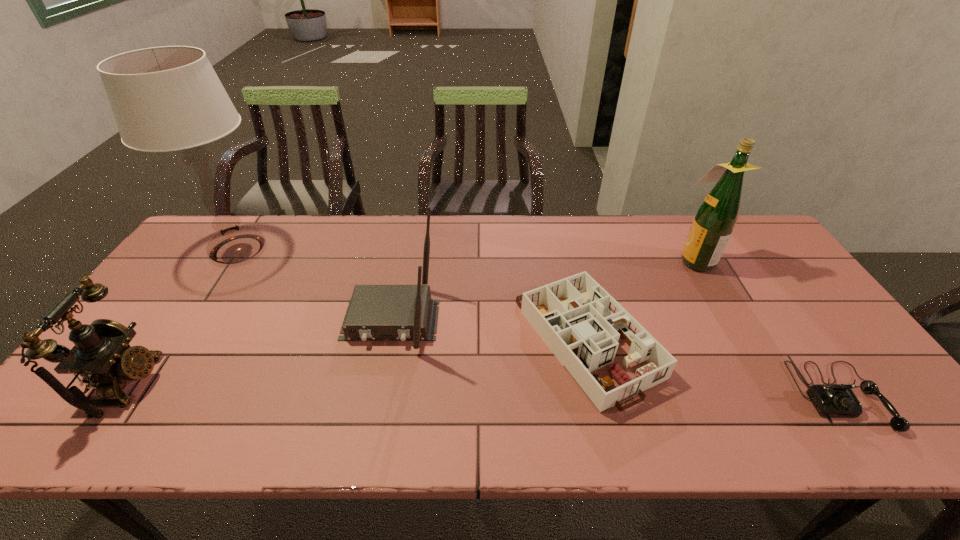
The height and width of the screenshot is (540, 960). What are the coordinates of `object located at the right edge` in the screenshot? It's located at (831, 400).

Where is `object that is positioned at the far left corner`? object that is positioned at the far left corner is located at coordinates (169, 98).

Locate an element on the screen. This screenshot has height=540, width=960. object that is at the near left corner is located at coordinates (101, 354).

At what (x,y) coordinates should I click in order to perform the action: click on object at the near right corner. Please return your answer as a coordinate pair (x, y). This screenshot has height=540, width=960. Looking at the image, I should click on (831, 400).

Identify the location of vacant space at the far edge of the desktop. 500,220.

Where is `vacant space at the near edge of the desktop`? The height and width of the screenshot is (540, 960). vacant space at the near edge of the desktop is located at coordinates (729, 412).

Where is `free region at the left edge`? free region at the left edge is located at coordinates (147, 301).

Locate an element on the screen. Image resolution: width=960 pixels, height=540 pixels. vacant point at the right edge is located at coordinates (852, 361).

Where is `vacant space at the far right corner`? vacant space at the far right corner is located at coordinates (764, 244).

The image size is (960, 540). In order to click on vacant space at the near right corner of the desktop in this screenshot , I will do `click(840, 419)`.